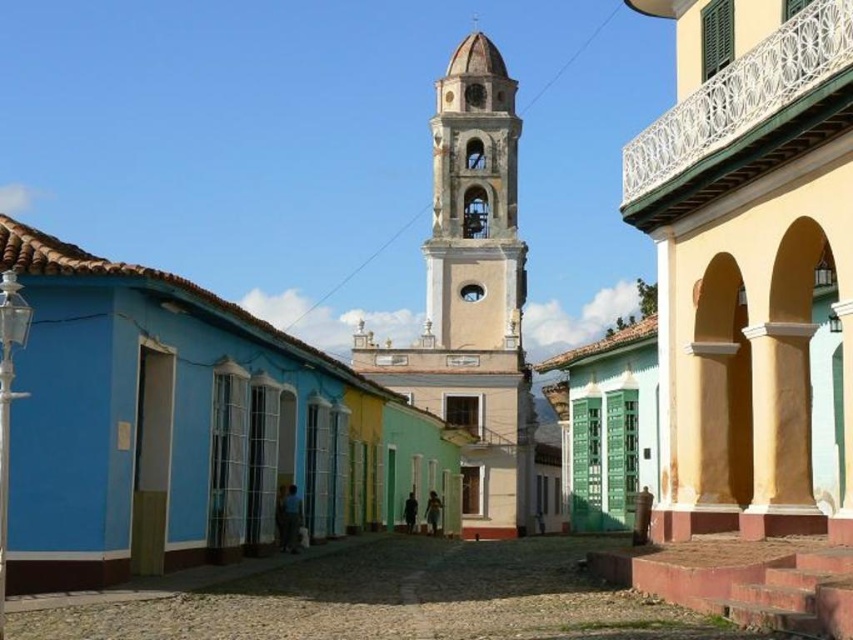
Is point (463, 531) behind point (477, 316)?

No.

Is point (442, 237) positioned after point (486, 76)?

That is False.

You are a GUI agent. You are given a task and a screenshot of the screen. Output one action in this format:
    pyautogui.click(x=<x>, y=<y>)
    Task: Click on the light yellow stucco church at center
    This screenshot has width=853, height=640.
    Given the screenshot: What is the action you would take?
    pyautogui.click(x=473, y=296)